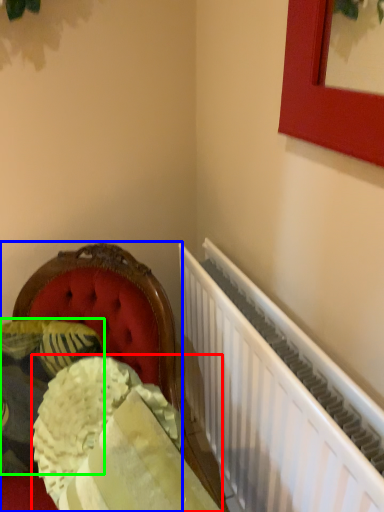
Question: Based on their relative distances, which object is nearer to material (highlighted by a red box)? Choose from furniture (highlighted by a blue box) and pillow (highlighted by a green box).

Choices:
 (A) furniture
 (B) pillow

Answer: (B)